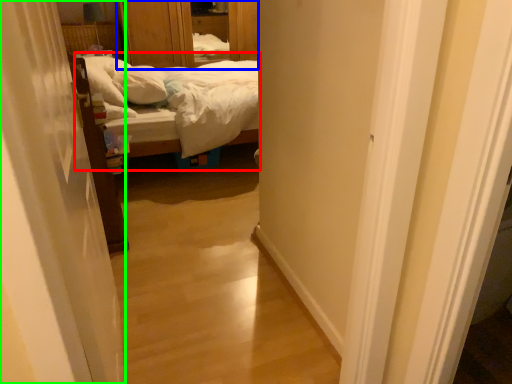
Question: Which object is positioned farthest from bed (highlighted by a red box)? Select from dresser (highlighted by a blue box) and curtain (highlighted by a green box).

Choices:
 (A) dresser
 (B) curtain

Answer: (A)